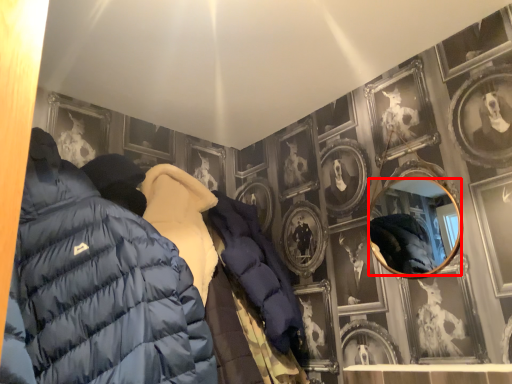
Question: From the image's perspective, what is the correct spatial positioning of mirror (annotated by the red box) in reference to jacket?

Choices:
 (A) above
 (B) below

Answer: (A)